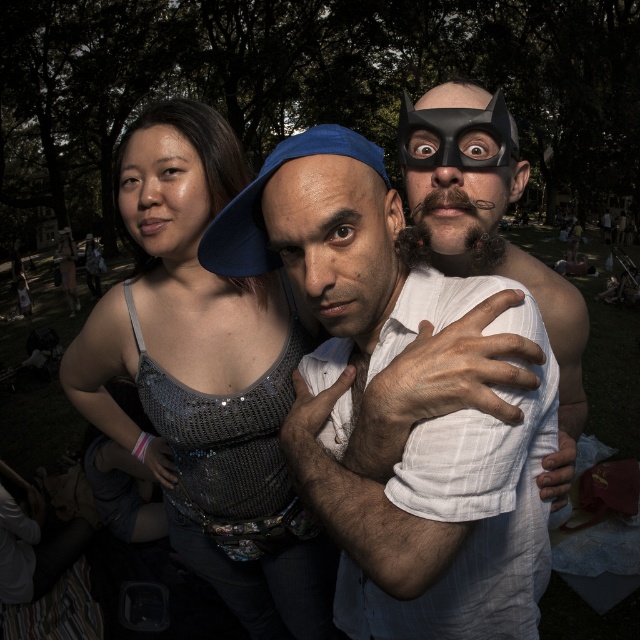
Question: Is shiny sequined tank top at center positioned behind black matte mask at upper center?

Choices:
 (A) yes
 (B) no

Answer: (A)

Question: Estimate the real-world distances between objects in this image. Which object is farther from the black matte mask at upper right?

Choices:
 (A) matte black mask at upper right
 (B) shiny sequined tank top at center
 (C) white textured shirt at center

Answer: (B)

Question: Among these points, which one is nearest to the camera?

Choices:
 (A) (317, 298)
 (B) (499, 346)

Answer: (B)

Question: Is the position of smooth skin face at upper left more distant than that of black matte mask at upper center?

Choices:
 (A) yes
 (B) no

Answer: (A)

Question: Is matte black mask at upper right to the left of black matte mask at upper right from the viewer's perspective?

Choices:
 (A) yes
 (B) no

Answer: (B)

Question: Which of the following is the closest to the observer?

Choices:
 (A) matte black mask at upper right
 (B) white textured shirt at center
 (C) smooth skin face at upper left

Answer: (B)